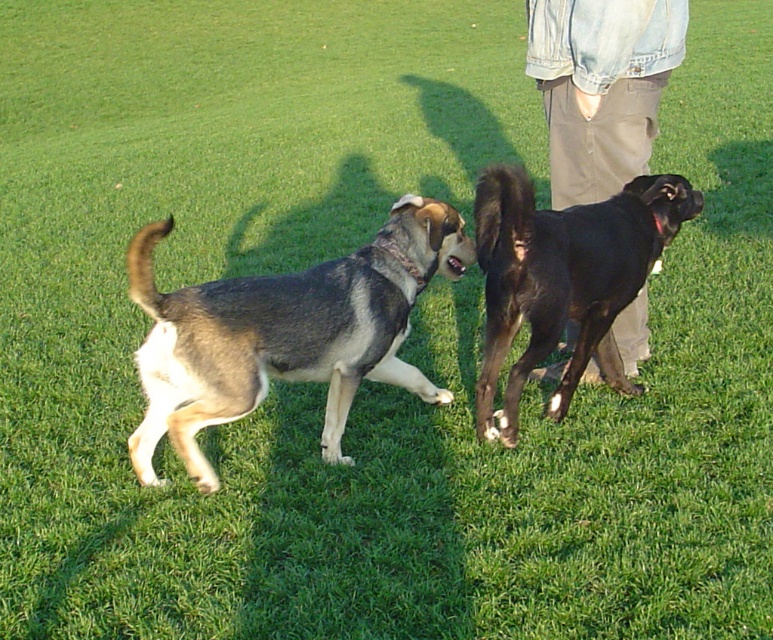
You are a dog owner trying to locate your dog in a field. You see a black glossy dog at right and khaki pants at center. Which dog is closer to you?

The black glossy dog at right is closer to you because it is in front of the khaki pants at center.